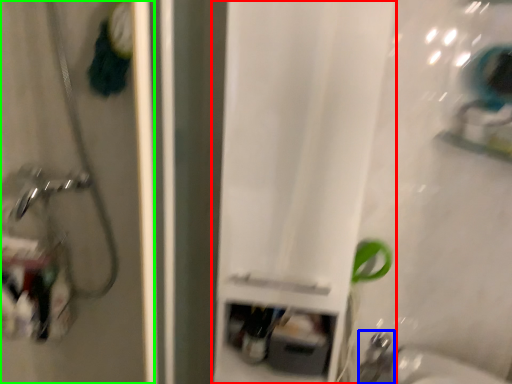
Question: Based on their relative distances, which object is nearer to curtain (highlighted by a red box)? Choose from faucet (highlighted by a blue box) and screen door (highlighted by a green box).

Choices:
 (A) faucet
 (B) screen door

Answer: (B)